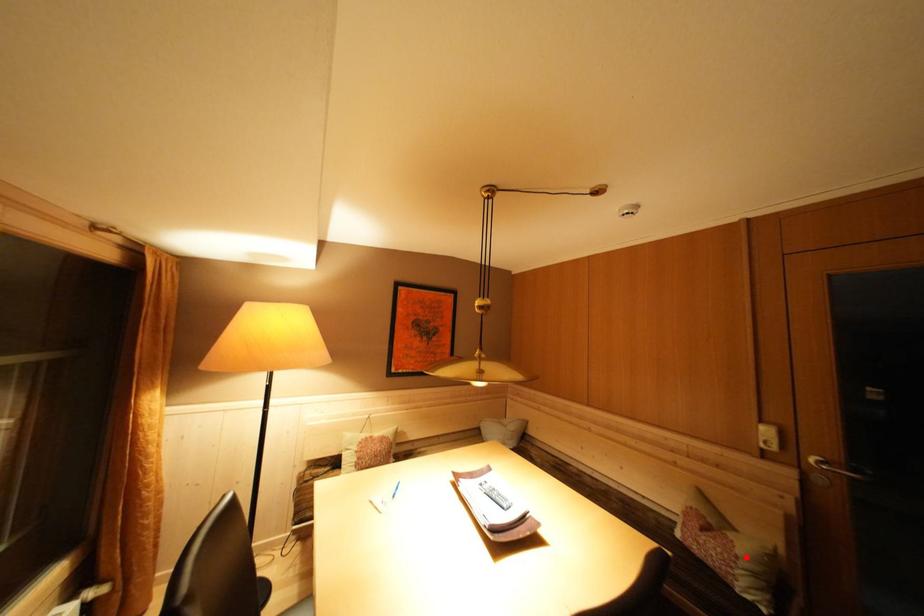
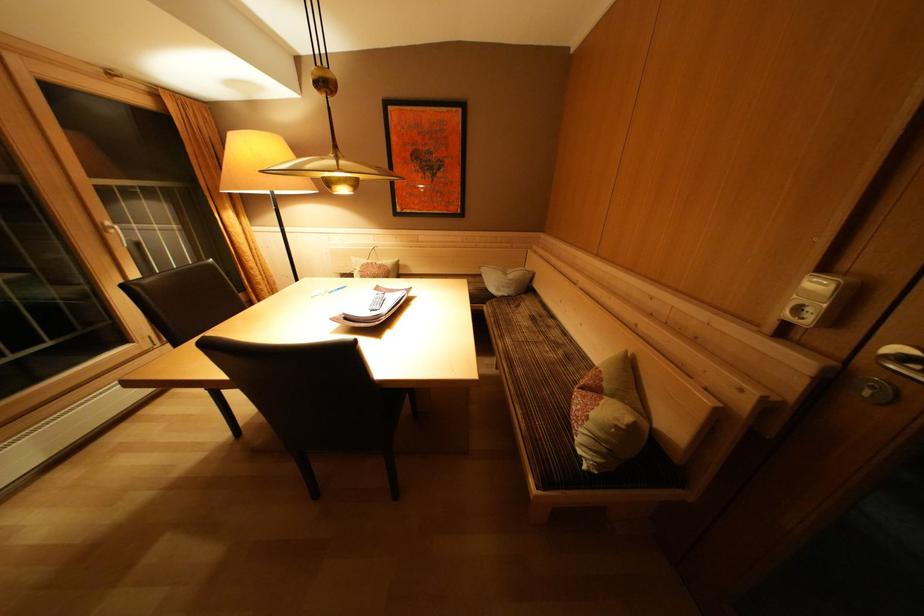
The point at the highlighted location is marked in the first image. Where is the corresponding point in the second image?

(600, 419)